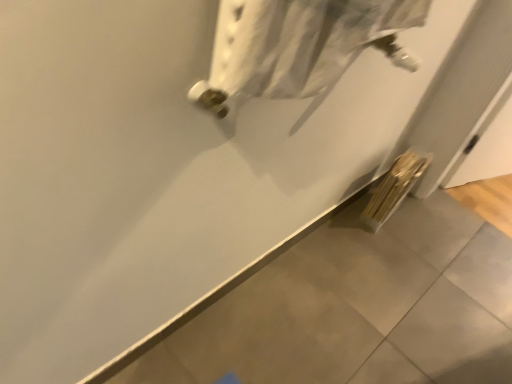
At what (x,y) coordinates should I click in order to perform the action: click on free region on the left part of wooden sticks at lower right. Please return your answer as a coordinate pair (x, y). The image size is (512, 384). Looking at the image, I should click on (351, 216).